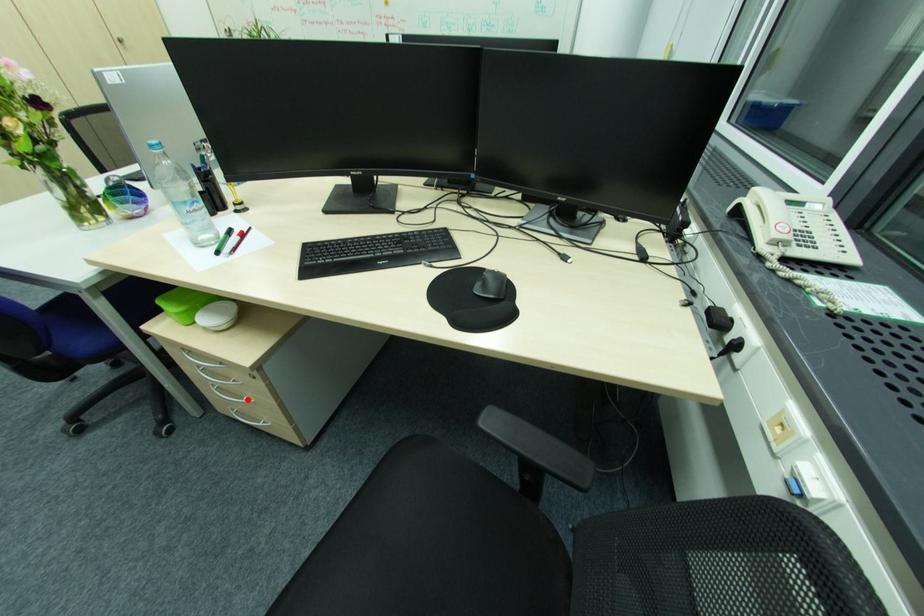
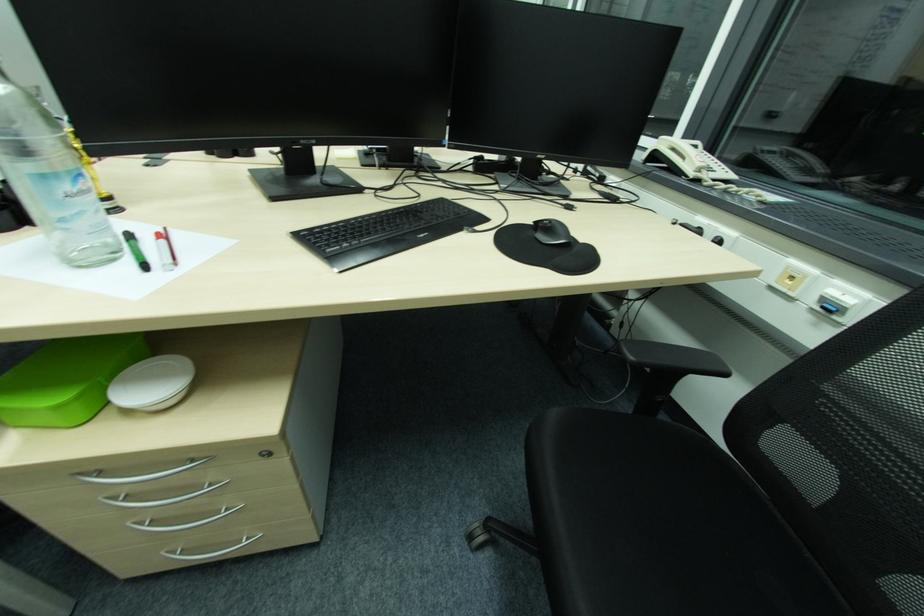
Question: A red point is marked in image1. In image2, is the corresponding 3D point closer to the camera or farther? Reply with the corresponding letter.

Choices:
 (A) The corresponding 3D point is closer.
 (B) The corresponding 3D point is farther.

Answer: (A)